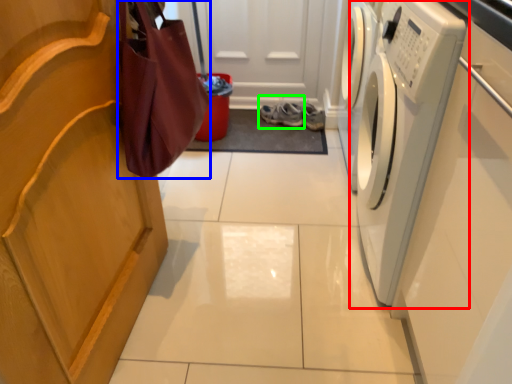
Question: Which object is the farthest from washing machine (highlighted by a red box)? Choose among these: shopping bag (highlighted by a blue box) or footwear (highlighted by a green box).

Choices:
 (A) shopping bag
 (B) footwear

Answer: (B)